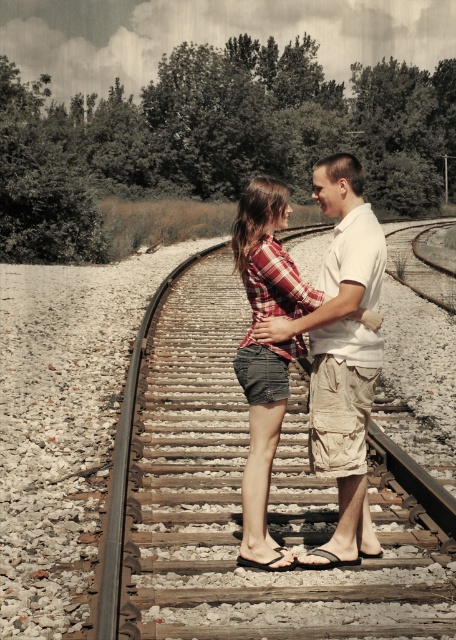
Question: Does white cotton shirt at center have a lesser width compared to plaid fabric shorts at center?

Choices:
 (A) yes
 (B) no

Answer: (B)

Question: Which object appears closest to the camera in this image?

Choices:
 (A) white cotton shirt at center
 (B) wooden planks at center
 (C) plaid fabric shorts at center

Answer: (B)

Question: Which of the following is the farthest from the observer?

Choices:
 (A) (358, 429)
 (B) (257, 552)

Answer: (B)

Question: Does white cotton shirt at center appear under plaid fabric shorts at center?

Choices:
 (A) no
 (B) yes

Answer: (A)

Question: Which of the following is the farthest from the observer?

Choices:
 (A) wooden planks at center
 (B) white cotton shirt at center

Answer: (B)

Question: Is white cotton shirt at center to the right of plaid fabric shorts at center from the viewer's perspective?

Choices:
 (A) yes
 (B) no

Answer: (A)